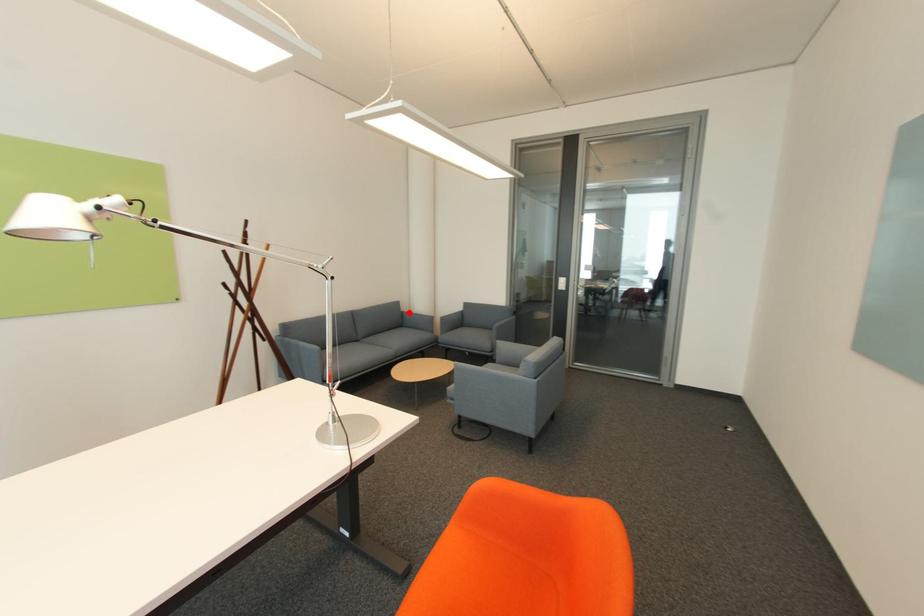
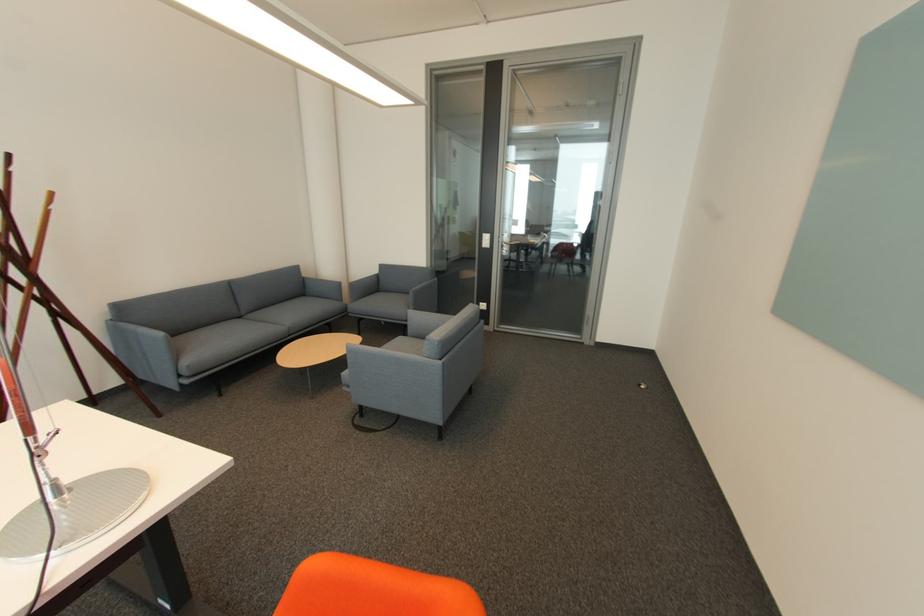
Question: I am providing you with two images of the same scene from different viewpoints. Given a red point in image1, look at the same physical point in image2. Is it:

Choices:
 (A) Closer to the viewpoint
 (B) Farther from the viewpoint

Answer: (B)